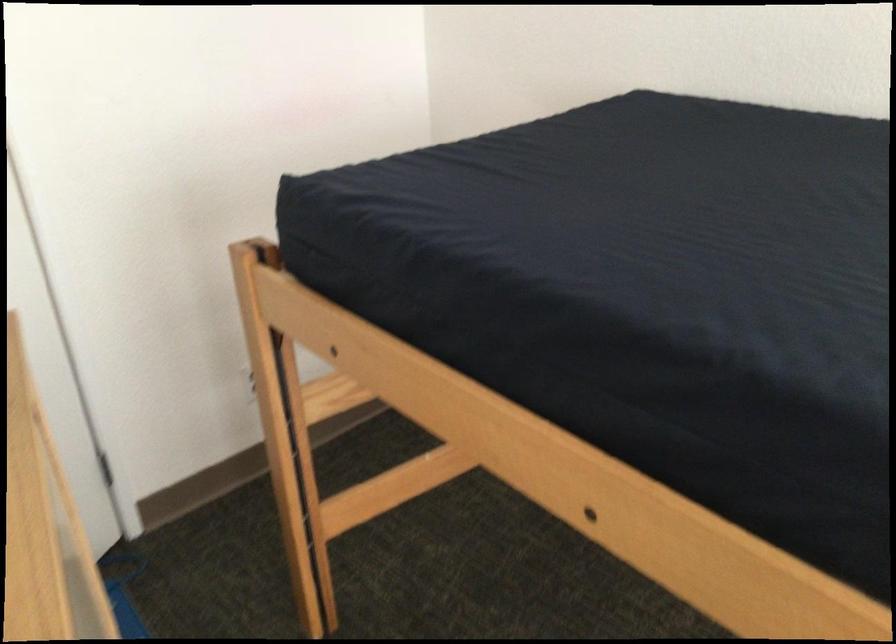
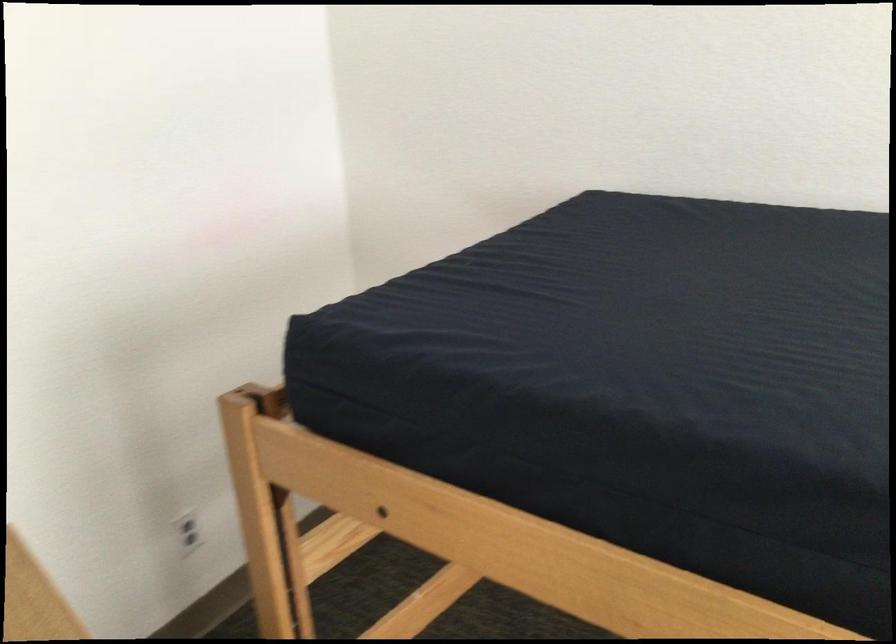
Question: The camera is either moving clockwise (left) or counter-clockwise (right) around the object. The first image is from the beginning of the video and the second image is from the end. Is the camera moving left or right when shooting the video?

Choices:
 (A) Left
 (B) Right

Answer: (A)